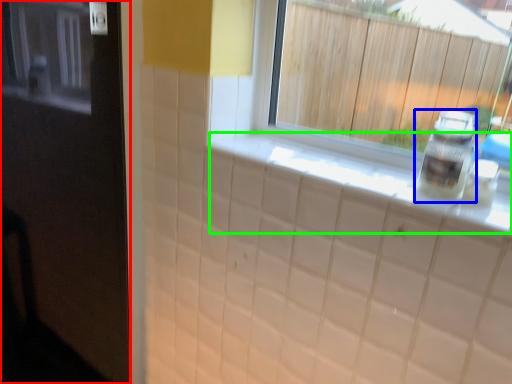
Question: Which object is positioned closest to door (highlighted by a red box)? Select from bottle (highlighted by a blue box) and counter top (highlighted by a green box).

Choices:
 (A) bottle
 (B) counter top

Answer: (B)